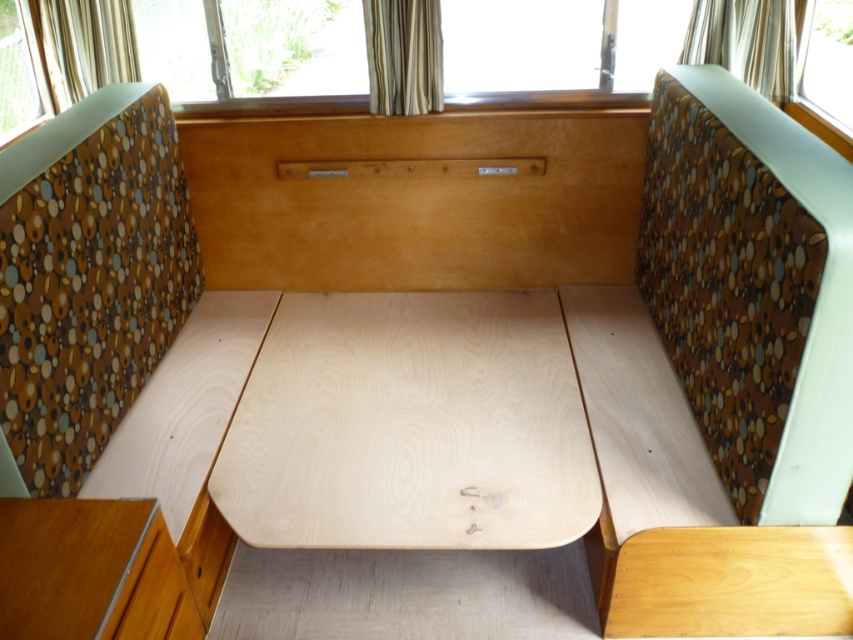
Can you confirm if striped fabric curtain at upper left is thinner than striped fabric curtain at upper center?

In fact, striped fabric curtain at upper left might be wider than striped fabric curtain at upper center.

Who is more distant from viewer, (x=62, y=99) or (x=402, y=19)?

The point (x=62, y=99) is behind.

Which is in front, point (51, 13) or point (403, 1)?

Point (403, 1) is more forward.

This screenshot has width=853, height=640. Identify the location of striped fabric curtain at upper left. (85, 45).

Does natural wood table at center appear under transparent glass window at upper right?

Yes.

Who is more distant from viewer, (285, 296) or (834, 83)?

The point (285, 296) is behind.

Is point (321, 419) positioned before point (828, 109)?

Yes, point (321, 419) is in front of point (828, 109).

Where is `natural wood table at center`? natural wood table at center is located at coordinates point(409,426).

Is point (503, 547) closer to camera compared to point (418, 26)?

That is True.

Can you confirm if natural wood table at center is thinner than striped fabric curtain at upper center?

In fact, natural wood table at center might be wider than striped fabric curtain at upper center.

This screenshot has width=853, height=640. I want to click on natural wood table at center, so click(x=409, y=426).